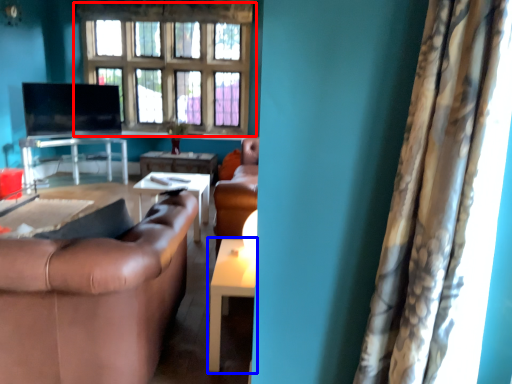
Question: Which of the following is the closest to the observer, window (highlighted by a red box) or table (highlighted by a blue box)?

Choices:
 (A) window
 (B) table

Answer: (B)